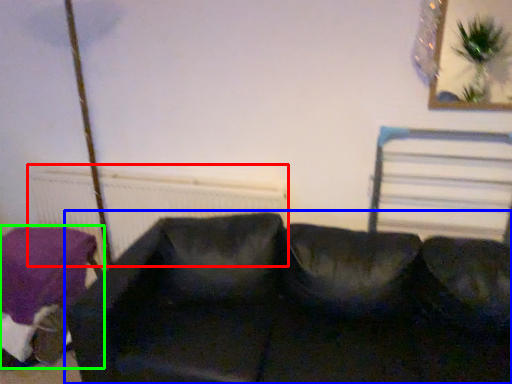
Question: Based on their relative distances, which object is farther from radiator (highlighted by a red box)? Choose from studio couch (highlighted by a blue box) and furniture (highlighted by a green box).

Choices:
 (A) studio couch
 (B) furniture

Answer: (A)